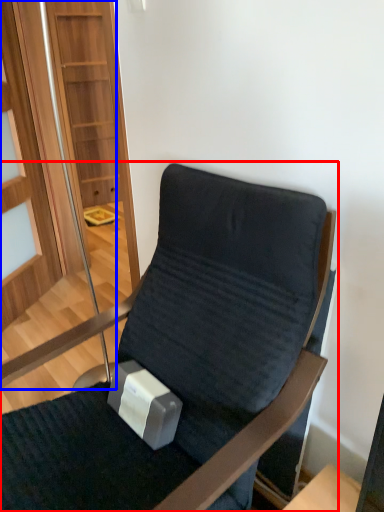
Question: Among these objects, which one is farthest to the camera, chair (highlighted by a red box) or glass door (highlighted by a blue box)?

Choices:
 (A) chair
 (B) glass door

Answer: (B)